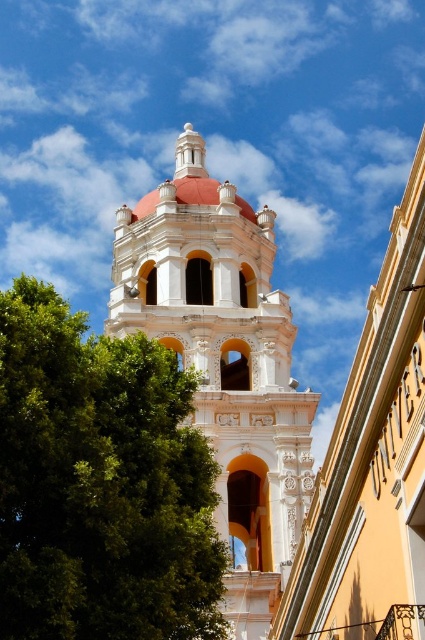
You are standing in front of the white ornate tower at center and want to take a photo that includes both the green leafy tree at left and the tower. Since the tree is to the left, will you need to adjust your camera angle to include both?

The green leafy tree at left is thinner than the white ornate tower at center, so you will need to adjust your camera angle to include both the green leafy tree at left and the white ornate tower at center in the photo because the tree is narrower and might be partially hidden behind the tower if not framed properly.

You are standing in front of the tower and want to take a photo that includes both the tower and the green leafy tree at left. Based on their positions, which side of the tower should you position yourself to ensure both are in the frame?

Since the green leafy tree at left is positioned at point (99, 483), you should position yourself to the left side of the tower to include both the tower and the green leafy tree at left in the frame.